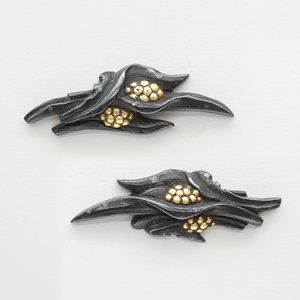
The image size is (300, 300). Identify the location of figurines. (174, 202), (120, 98).